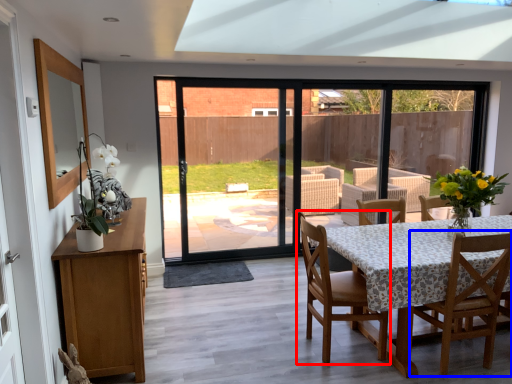
Question: Which object appears closest to the camera in this image, chair (highlighted by a red box) or chair (highlighted by a blue box)?

Choices:
 (A) chair
 (B) chair

Answer: (B)